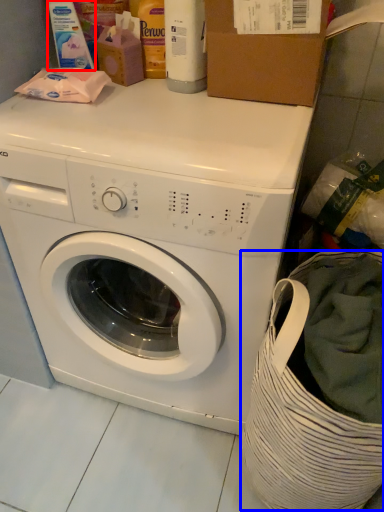
Question: Which object is closer to the camera taking this photo, cleaning product (highlighted by a red box) or laundry basket (highlighted by a blue box)?

Choices:
 (A) cleaning product
 (B) laundry basket

Answer: (B)